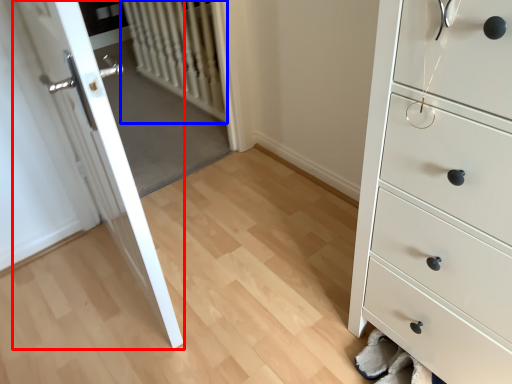
Question: Which object is closer to the camera taking this photo, door (highlighted by a red box) or radiator (highlighted by a blue box)?

Choices:
 (A) door
 (B) radiator

Answer: (A)